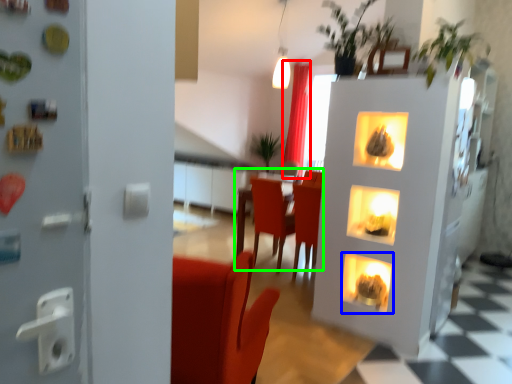
Question: Which is nearer to the curtain (highlighted by a red box)? fireplace (highlighted by a blue box) or table (highlighted by a green box).

Choices:
 (A) fireplace
 (B) table

Answer: (B)